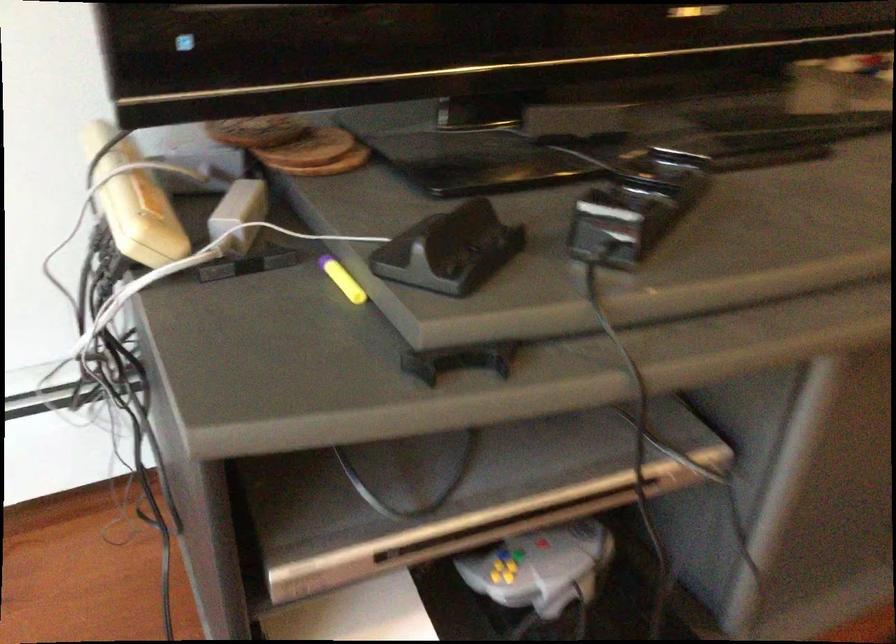
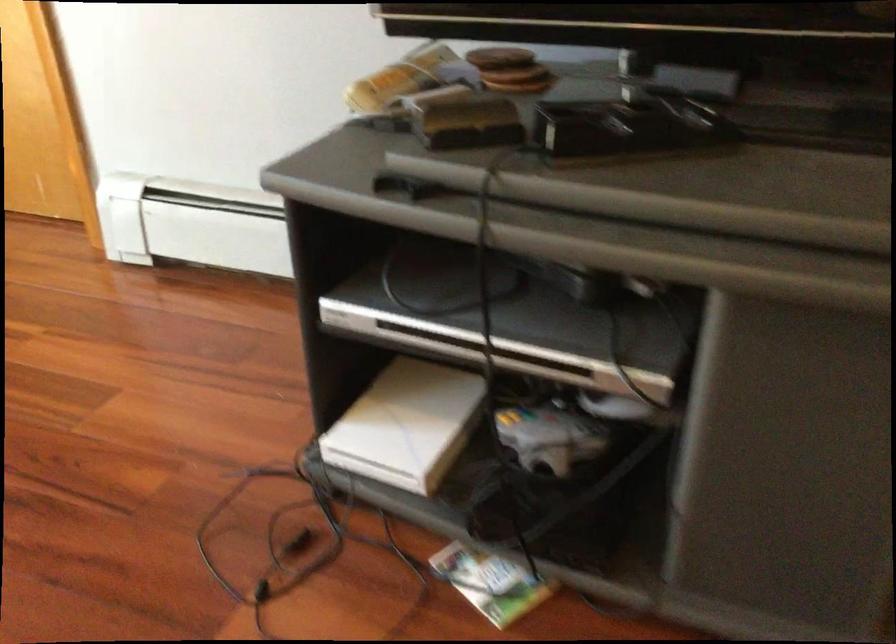
Where in the second image is the point corresponding to the point at 319,149 from the first image?

(519, 80)